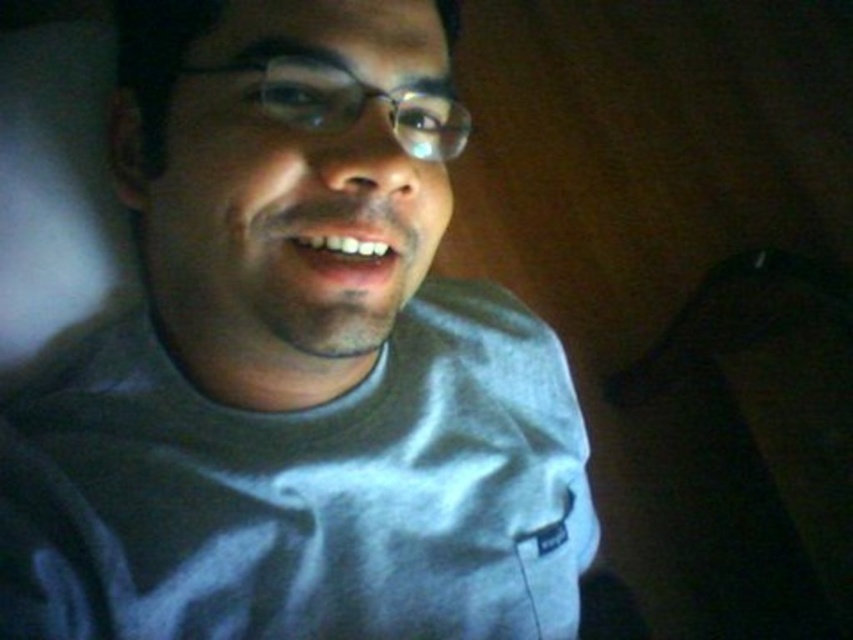
You are a photographer adjusting the lighting in a dimly lit room. You notice the gray cotton shirt at center and the black fabric at lower right in your frame. Which object should you focus the light on to ensure it stands out more against the dark background?

The gray cotton shirt at center has a smaller size compared to black fabric at lower right, so focusing the light on the gray cotton shirt at center would make it stand out more against the dark background due to its smaller size and lighter color.

You are holding a flashlight and want to shine it on the point at coordinates point (474, 627). If the flashlight has a beam width of 10 inches, will it cover the point?

The point point (474, 627) is 21.85 inches away from the viewer. Since the flashlight beam width is 10 inches, which is narrower than the distance to the point, the beam will not cover the point.

You are a photographer setting up a shoot in a dimly lit room. You notice the gray cotton shirt at center and the black fabric at lower right in the frame. Which object should you adjust to ensure proper lighting on the subject?

The gray cotton shirt at center is positioned on the left side of black fabric at lower right. To ensure proper lighting on the subject, adjust the gray cotton shirt at center since it is closer to the subject and requires balanced illumination compared to the black fabric at lower right.